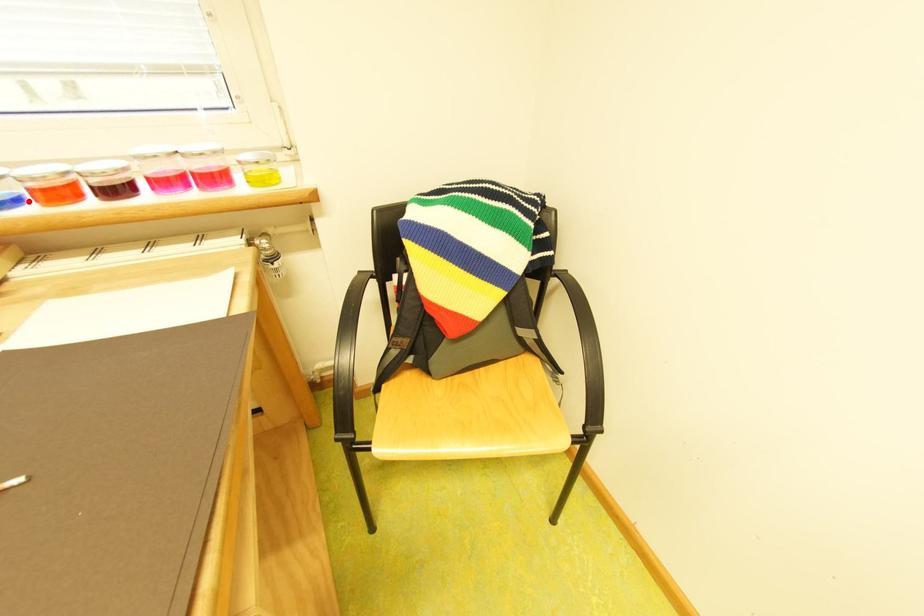
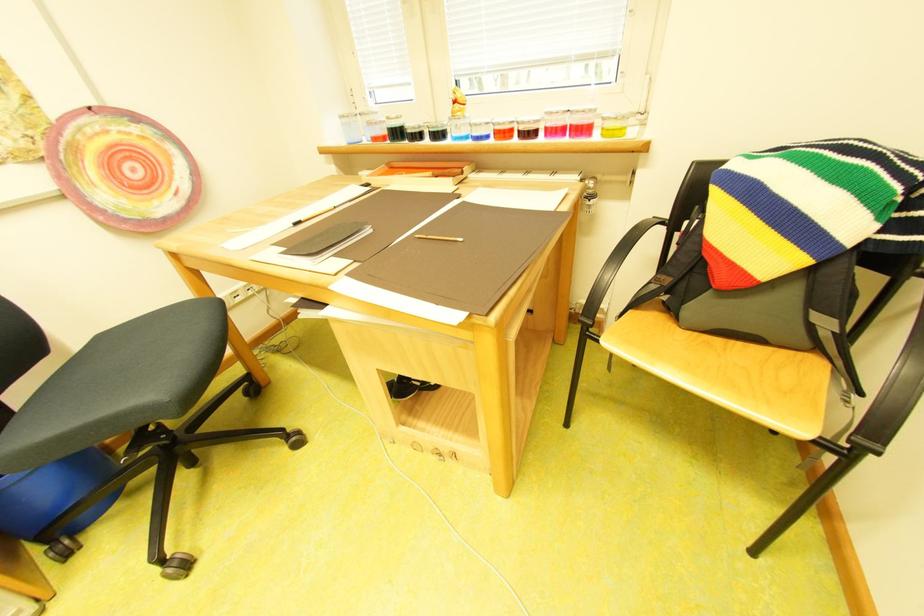
Where in the second image is the point corresponding to the highlighted location from the first image?

(499, 138)